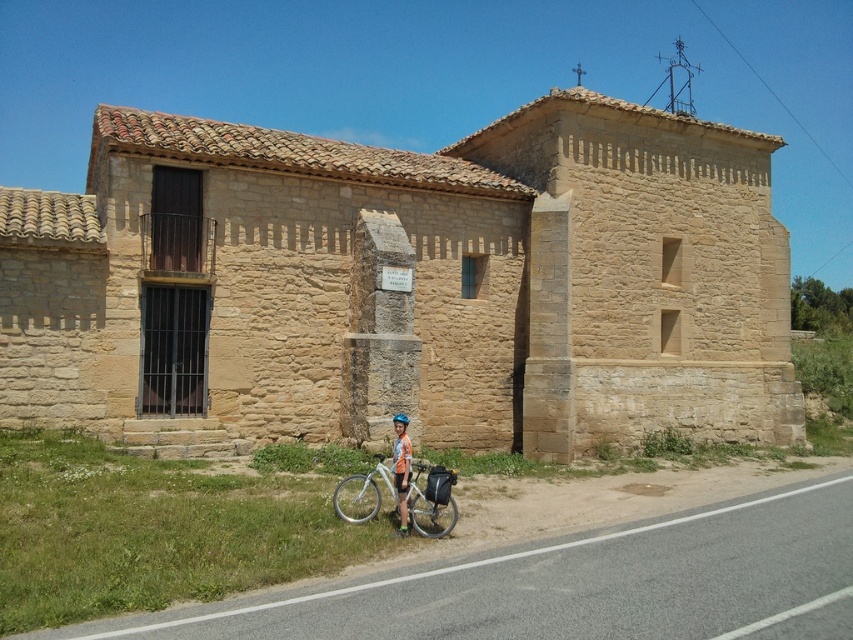
You are standing in front of the rustic stone building and want to determine the relative positions of two points marked on the structure. Which point, point (440, 500) or point (405, 417), is closer to you?

Point (440, 500) is closer to the viewer than point (405, 417).